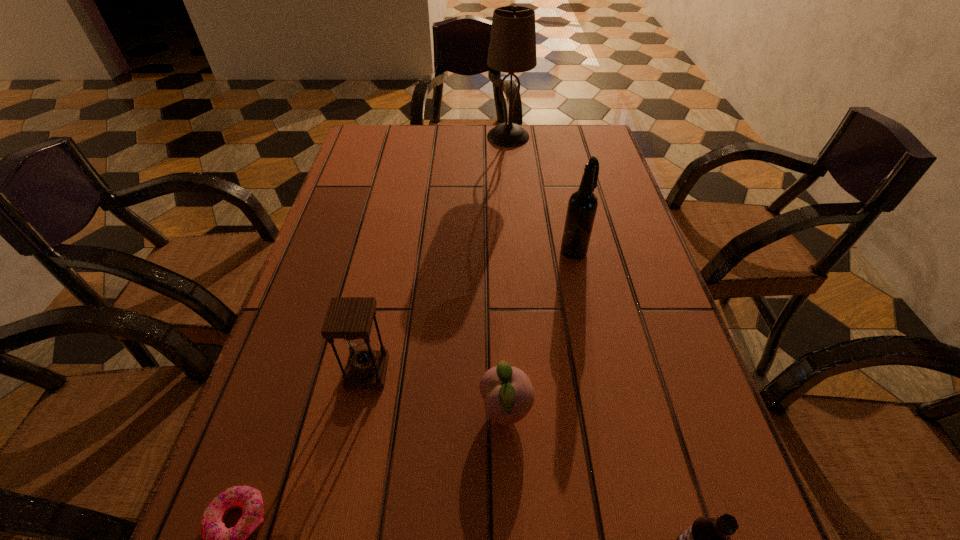
Image resolution: width=960 pixels, height=540 pixels. Identify the location of free region located 0.290m on the back of the second object from left to right. (392, 251).

At what (x,y) coordinates should I click in order to perform the action: click on vacant area situated on the left of the peach. Please return your answer as a coordinate pair (x, y). The image size is (960, 540). Looking at the image, I should click on (403, 410).

Image resolution: width=960 pixels, height=540 pixels. I want to click on object present at the far edge, so click(x=512, y=48).

At what (x,y) coordinates should I click in order to perform the action: click on object located in the left edge section of the desktop. Please return your answer as a coordinate pair (x, y). This screenshot has width=960, height=540. Looking at the image, I should click on (348, 318).

Where is `object that is at the right edge`? object that is at the right edge is located at coordinates tap(582, 206).

Where is `free space at the far edge of the desktop`? This screenshot has width=960, height=540. free space at the far edge of the desktop is located at coordinates (428, 150).

At what (x,y) coordinates should I click in order to perform the action: click on vacant space at the left edge of the desktop. Please return your answer as a coordinate pair (x, y). Looking at the image, I should click on (372, 294).

Where is `vacant region at the right edge of the desktop`? vacant region at the right edge of the desktop is located at coordinates (636, 354).

Find the location of a particular element. This screenshot has width=960, height=540. free space at the far left corner is located at coordinates (363, 127).

This screenshot has width=960, height=540. I want to click on vacant space in between the second object from left to right and the fifth tallest object, so click(437, 391).